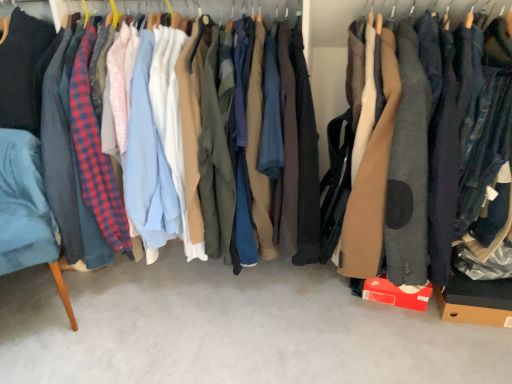
Question: Should I look upward or downward to see brown cardboard box at lower right?

Choices:
 (A) up
 (B) down

Answer: (B)

Question: From the image's perspective, is matte brown coat at center beneath velvet blue armchair at left?

Choices:
 (A) no
 (B) yes

Answer: (A)

Question: Can you confirm if matte brown coat at center is taller than velvet blue armchair at left?

Choices:
 (A) no
 (B) yes

Answer: (B)

Question: Considering the relative positions of matte brown coat at center and velvet blue armchair at left in the image provided, is matte brown coat at center to the right of velvet blue armchair at left from the viewer's perspective?

Choices:
 (A) yes
 (B) no

Answer: (A)

Question: Can you confirm if matte brown coat at center is bigger than velvet blue armchair at left?

Choices:
 (A) yes
 (B) no

Answer: (A)

Question: Is matte brown coat at center oriented towards velvet blue armchair at left?

Choices:
 (A) yes
 (B) no

Answer: (B)

Question: Is matte brown coat at center positioned far away from velvet blue armchair at left?

Choices:
 (A) no
 (B) yes

Answer: (B)

Question: Is brown cardboard box at lower right wider than velvet blue armchair at left?

Choices:
 (A) no
 (B) yes

Answer: (A)

Question: Considering the relative sizes of brown cardboard box at lower right and velvet blue armchair at left in the image provided, is brown cardboard box at lower right smaller than velvet blue armchair at left?

Choices:
 (A) yes
 (B) no

Answer: (A)

Question: Can you confirm if brown cardboard box at lower right is positioned to the right of velvet blue armchair at left?

Choices:
 (A) yes
 (B) no

Answer: (A)

Question: Does brown cardboard box at lower right have a greater height compared to velvet blue armchair at left?

Choices:
 (A) no
 (B) yes

Answer: (A)

Question: From a real-world perspective, does brown cardboard box at lower right sit lower than velvet blue armchair at left?

Choices:
 (A) yes
 (B) no

Answer: (A)

Question: Is brown cardboard box at lower right not within velvet blue armchair at left?

Choices:
 (A) yes
 (B) no

Answer: (A)

Question: From a real-world perspective, does brown cardboard box at lower right stand above matte brown coat at center?

Choices:
 (A) yes
 (B) no

Answer: (B)